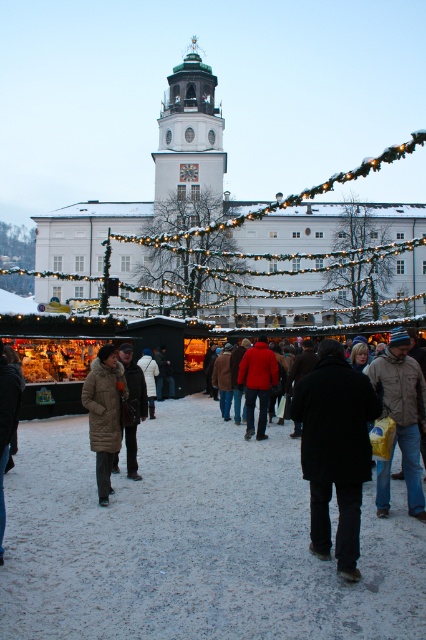
Question: Can you confirm if white stone bell tower at center is positioned to the right of brown leather jacket at center?

Choices:
 (A) no
 (B) yes

Answer: (A)

Question: From the image, what is the correct spatial relationship of brown leather jacket at center in relation to matte red jacket at center?

Choices:
 (A) left
 (B) right

Answer: (B)

Question: Among these objects, which one is nearest to the camera?

Choices:
 (A) white fur coat at center
 (B) brown wool coat at center
 (C) brown leather jacket at center
 (D) brown fur coat at lower left

Answer: (C)

Question: Which object is the farthest from the white fur coat at center?

Choices:
 (A) matte red jacket at center
 (B) brown wool coat at center
 (C) brown leather jacket at center
 (D) white stone bell tower at center

Answer: (D)

Question: From the image, what is the correct spatial relationship of brown leather jacket at center in relation to white fur coat at center?

Choices:
 (A) above
 (B) below

Answer: (A)

Question: Which point is closer to the camera?

Choices:
 (A) brown wool coat at center
 (B) brown leather jacket at center
 (C) brown fur coat at lower left
 (D) matte red jacket at center

Answer: (B)